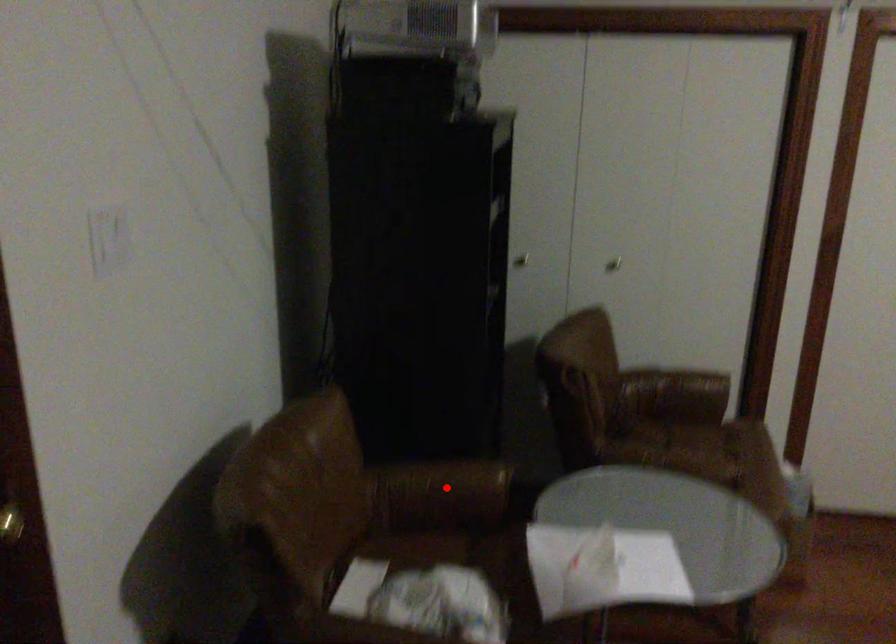
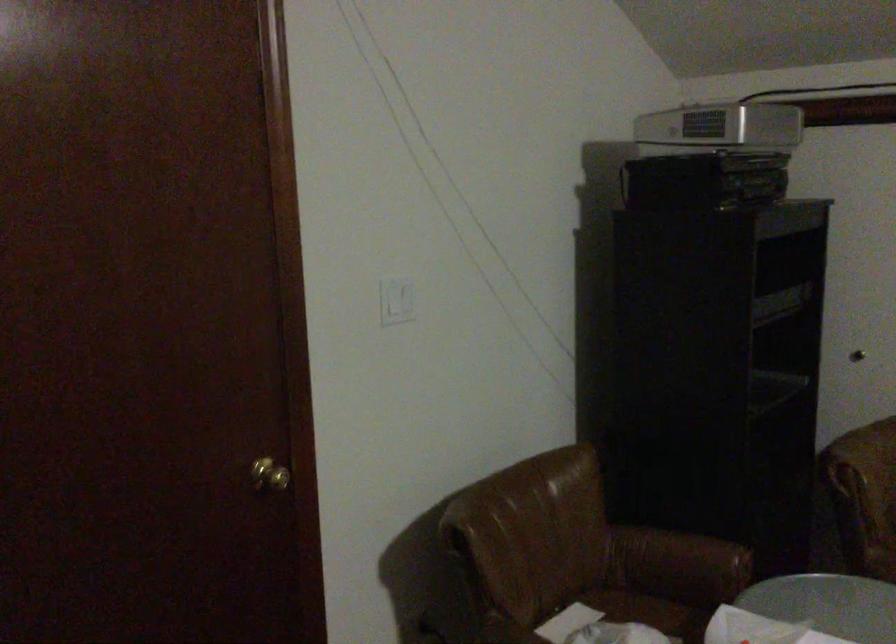
Where in the second image is the point corresponding to the highlighted location from the first image?

(679, 559)